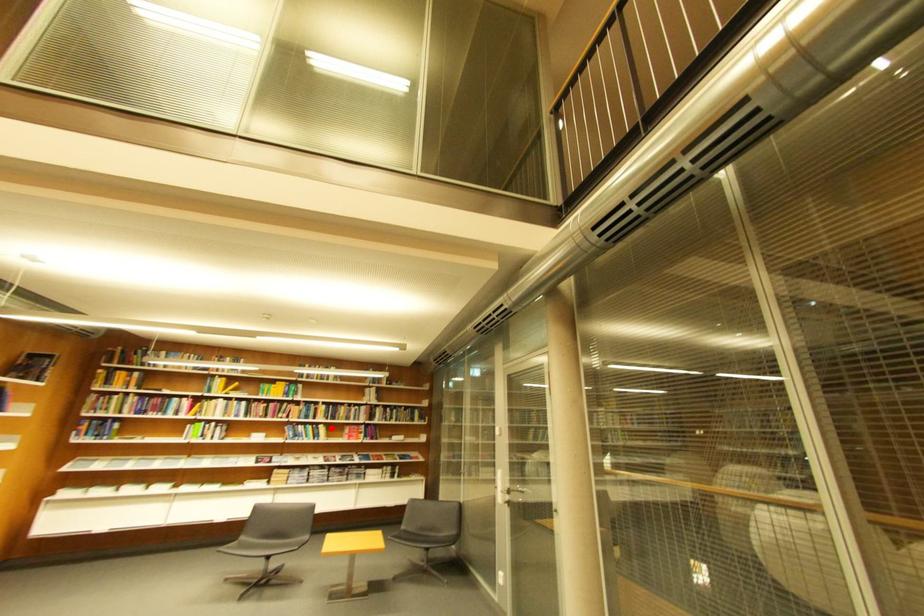
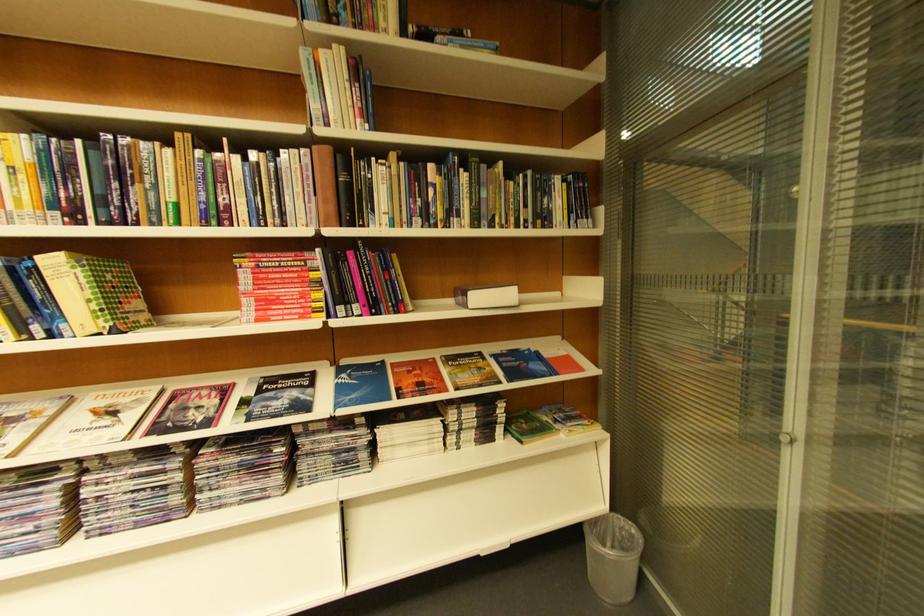
Find the pixel in the second image that matches the highlighted location in the first image.

(63, 264)